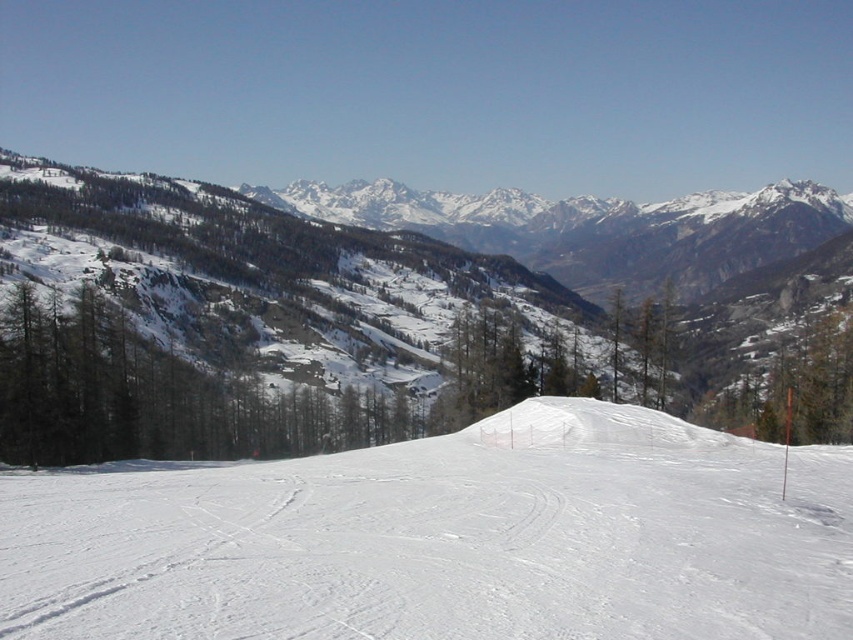
Which is behind, point (26, 436) or point (698, 412)?

Positioned behind is point (698, 412).

Which is above, green matte trees at left or green matte tree at right?

Positioned higher is green matte tree at right.

I want to click on green matte trees at left, so click(x=158, y=397).

Who is positioned more to the left, white snow ski slope at center or green matte trees at left?

green matte trees at left is more to the left.

Which is above, white snow ski slope at center or green matte trees at left?

green matte trees at left

Is point (489, 636) behind point (213, 396)?

No, (489, 636) is in front of (213, 396).

Image resolution: width=853 pixels, height=640 pixels. I want to click on white snow ski slope at center, so click(444, 538).

In the scene shown: Does white snow ski slope at center have a lesser width compared to green matte tree at right?

Yes.

Between white snow ski slope at center and green matte tree at right, which one has less height?

white snow ski slope at center is shorter.

This screenshot has width=853, height=640. I want to click on white snow ski slope at center, so click(x=444, y=538).